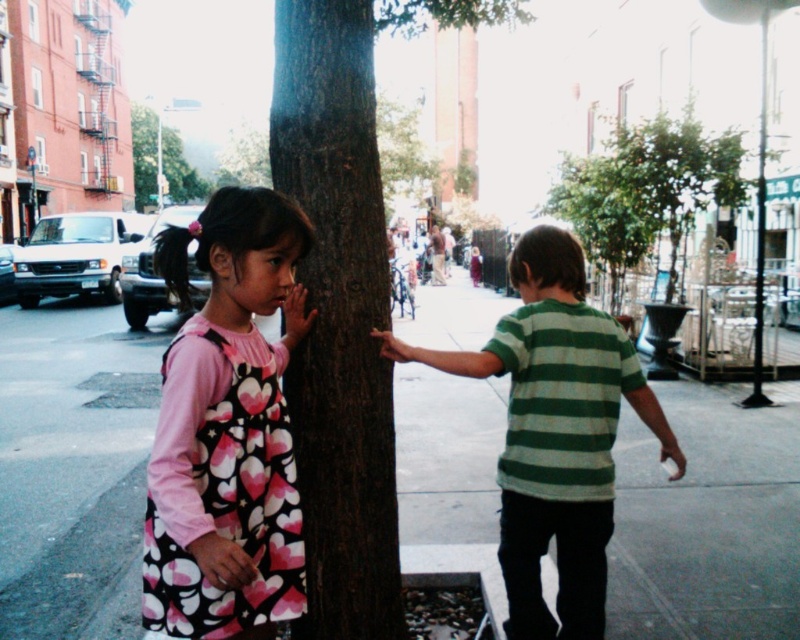
Question: Which point is closer to the camera?

Choices:
 (A) gray concrete sidewalk at center
 (B) green textured tree at upper center

Answer: (A)

Question: Can you confirm if brown rough tree trunk at center is positioned above green textured tree at upper center?

Choices:
 (A) yes
 (B) no

Answer: (B)

Question: Is pink heart-patterned dress at left above green striped shirt at center?

Choices:
 (A) no
 (B) yes

Answer: (B)

Question: Based on their relative distances, which object is farther from the pink heart-patterned dress at left?

Choices:
 (A) green leafy tree at center
 (B) green textured tree at upper center

Answer: (B)

Question: Is brown rough tree trunk at center to the right of green striped shirt at center from the viewer's perspective?

Choices:
 (A) no
 (B) yes

Answer: (A)

Question: Considering the real-world distances, which object is farthest from the green striped shirt at center?

Choices:
 (A) green leafy tree at center
 (B) gray concrete sidewalk at center

Answer: (A)